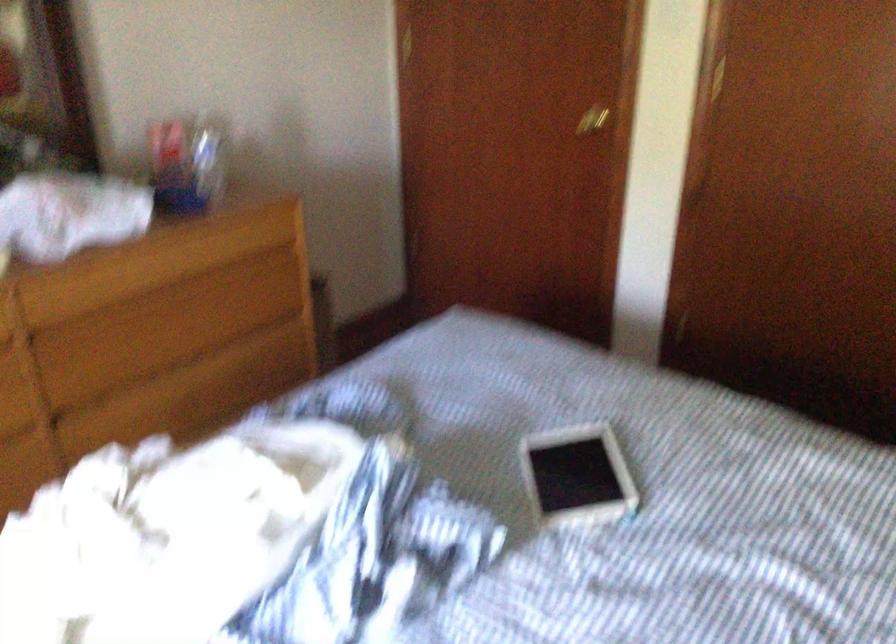
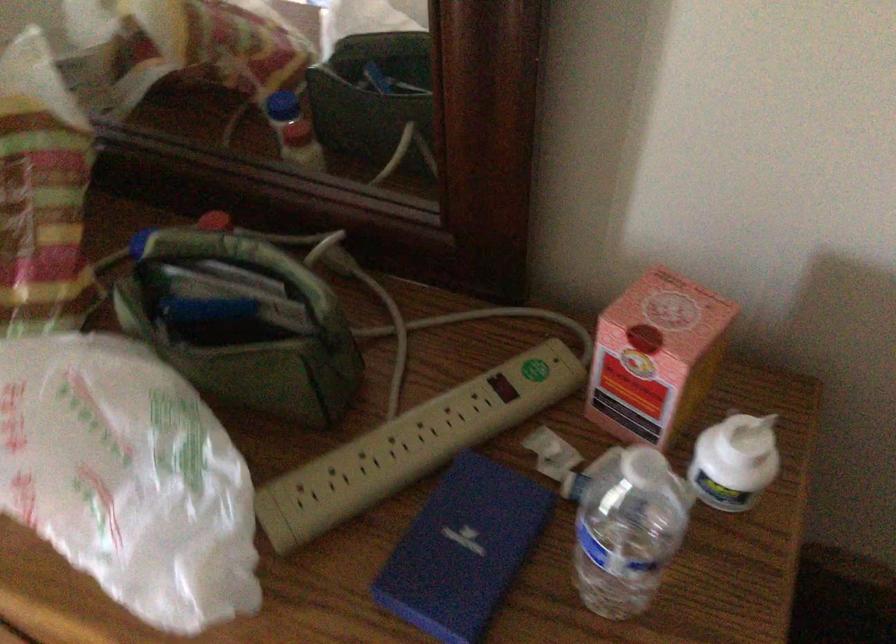
Where in the second image is the point corresponding to [85,207] from the first image?

(126, 478)